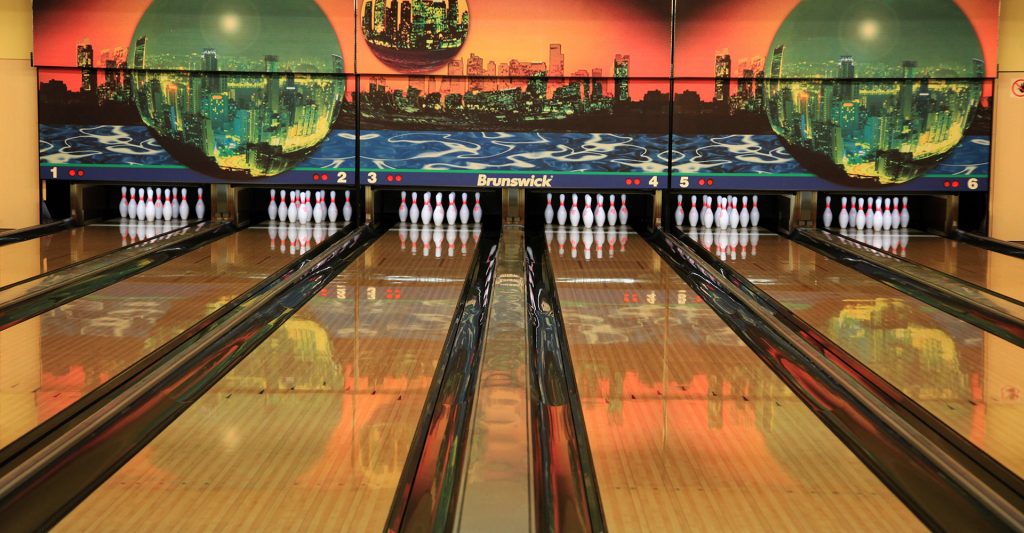
This screenshot has width=1024, height=533. What are the coordinates of `back panels` in the screenshot? It's located at (237, 44), (252, 115), (547, 43), (552, 113), (750, 42), (740, 125).